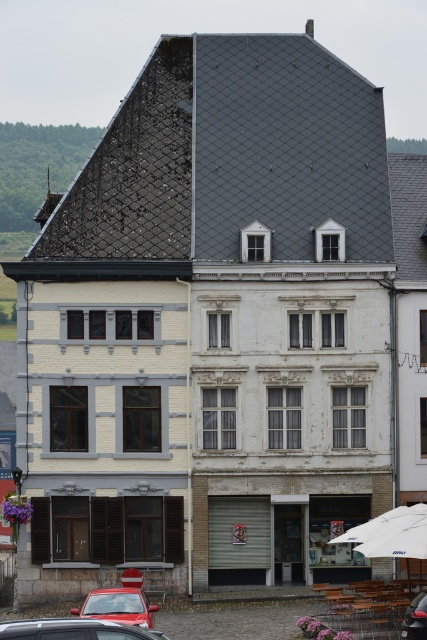
Between point (99, 593) and point (415, 612), which one is positioned in front?

Point (415, 612) is in front.

Does point (137, 621) lie in front of point (418, 609)?

No, it is behind (418, 609).

Is point (84, 611) less distant than point (411, 609)?

No, it is not.

You are a GUI agent. You are given a task and a screenshot of the screen. Output one action in this format:
    pyautogui.click(x=<x>, y=<y>)
    Task: Click on the shiny red car at lower left
    This screenshot has height=640, width=427.
    Given the screenshot: What is the action you would take?
    pyautogui.click(x=119, y=605)

Is metallic red car at lower left taller than shiny red car at lower left?

No.

Who is positioned more to the right, metallic red car at lower left or shiny red car at lower left?

metallic red car at lower left is more to the right.

Image resolution: width=427 pixels, height=640 pixels. I want to click on metallic red car at lower left, so click(x=75, y=628).

Locate an element on the screen. metallic red car at lower left is located at coordinates (75, 628).

Does point (5, 634) come closer to viewer compared to point (423, 624)?

Yes, point (5, 634) is in front of point (423, 624).

Image resolution: width=427 pixels, height=640 pixels. What are the coordinates of `metallic red car at lower left` in the screenshot? It's located at (x=75, y=628).